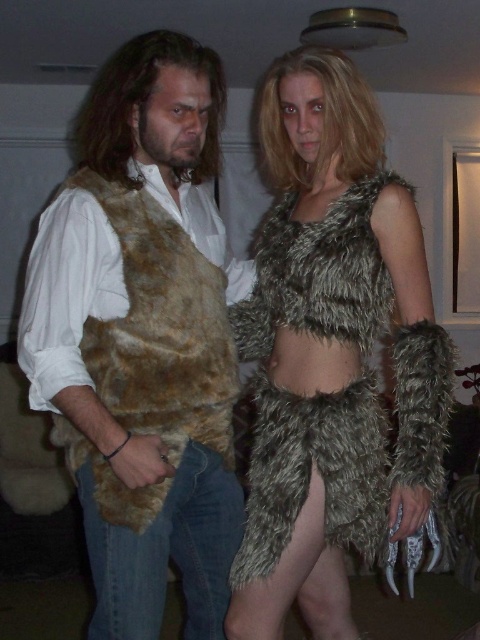
From the picture: You are a costume designer who needs to place a new accessory on the fuzzy brown vest at left. According to the image, where should you place it?

The fuzzy brown vest at left is located at point [143,337], so you should place the accessory at that coordinate.

You are a photographer standing 5 feet away from the fuzzy brown vest at left. Can you capture a clear closeup shot of the vest without moving closer?

The fuzzy brown vest at left is 4.01 feet away from the camera. Since you are standing 5 feet away, you are too far to capture a clear closeup shot without moving closer.

You are a photographer trying to capture both point (208, 160) and point (423, 374) in the frame. Which point is closer to your camera?

Point (208, 160) is closer to the camera than point (423, 374).